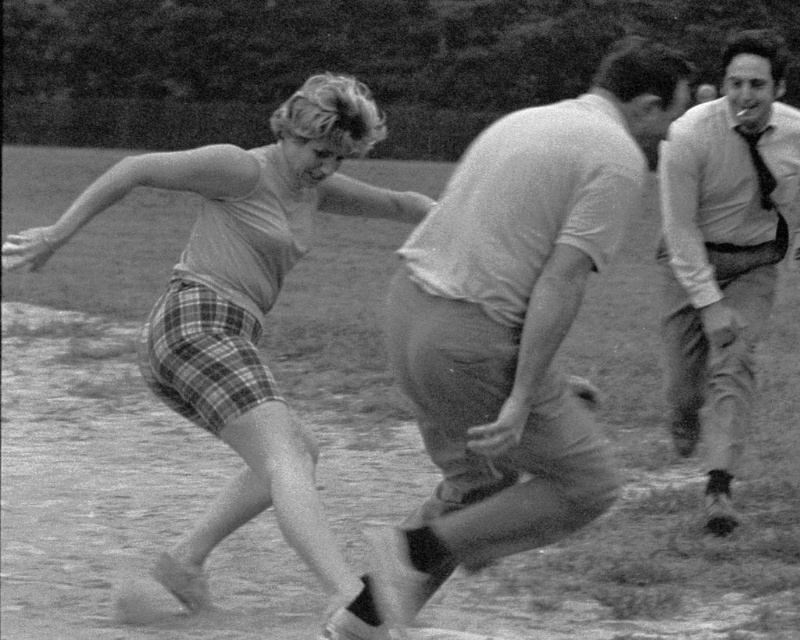
Is point (466, 307) positioned in front of point (720, 128)?

Yes.

Between point (588, 209) and point (756, 172), which one is positioned in front?

Point (588, 209) is in front.

At what (x,y) coordinates should I click in order to perform the action: click on smooth cotton shirt at center. Please return your answer as a coordinate pair (x, y). Looking at the image, I should click on (513, 324).

The height and width of the screenshot is (640, 800). What are the coordinates of `smooth cotton shirt at center` in the screenshot? It's located at (513, 324).

In the scene shown: Can you confirm if plaid shorts at left is wider than light beige shirt at right?

No, plaid shorts at left is not wider than light beige shirt at right.

Who is more forward, (316, 508) or (748, 33)?

Point (316, 508) is more forward.

At what (x,y) coordinates should I click in order to perform the action: click on plaid shorts at left. Please return your answer as a coordinate pair (x, y). Looking at the image, I should click on (245, 310).

At what (x,y) coordinates should I click in order to perform the action: click on smooth cotton shirt at center. Please return your answer as a coordinate pair (x, y). This screenshot has height=640, width=800. Looking at the image, I should click on (513, 324).

Can you confirm if smooth cotton shirt at center is positioned to the left of plaid shorts at left?

No, smooth cotton shirt at center is not to the left of plaid shorts at left.

Describe the element at coordinates (513, 324) in the screenshot. I see `smooth cotton shirt at center` at that location.

Locate an element on the screen. smooth cotton shirt at center is located at coordinates (513, 324).